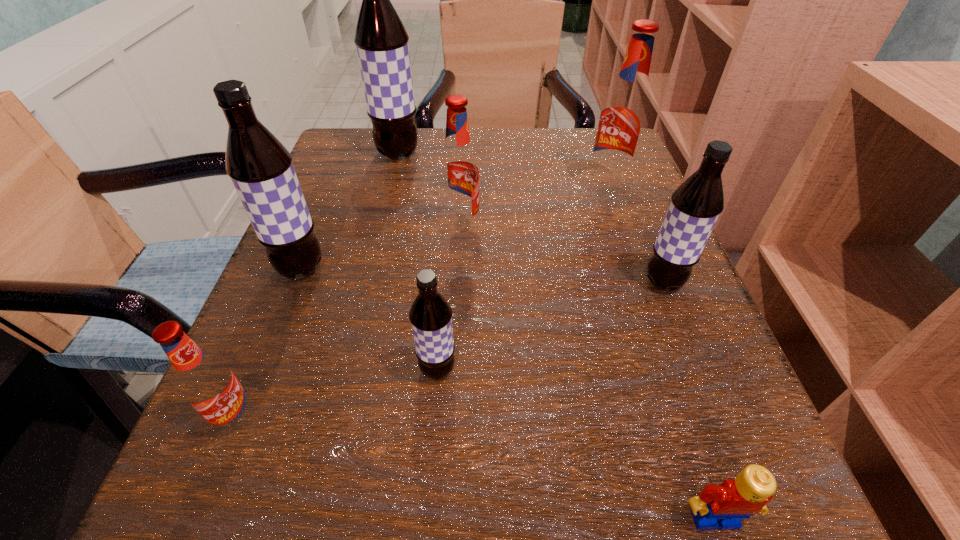
The width and height of the screenshot is (960, 540). Identify the location of vacant space that satisfies the following two spatial constraints: 1. on the back side of the rightmost brown root beer; 2. on the right side of the nearest brown root beer. (444, 282).

Find the location of a particular element. The height and width of the screenshot is (540, 960). free space that satisfies the following two spatial constraints: 1. on the front side of the tallest object; 2. on the left side of the second nearest red root beer is located at coordinates (380, 228).